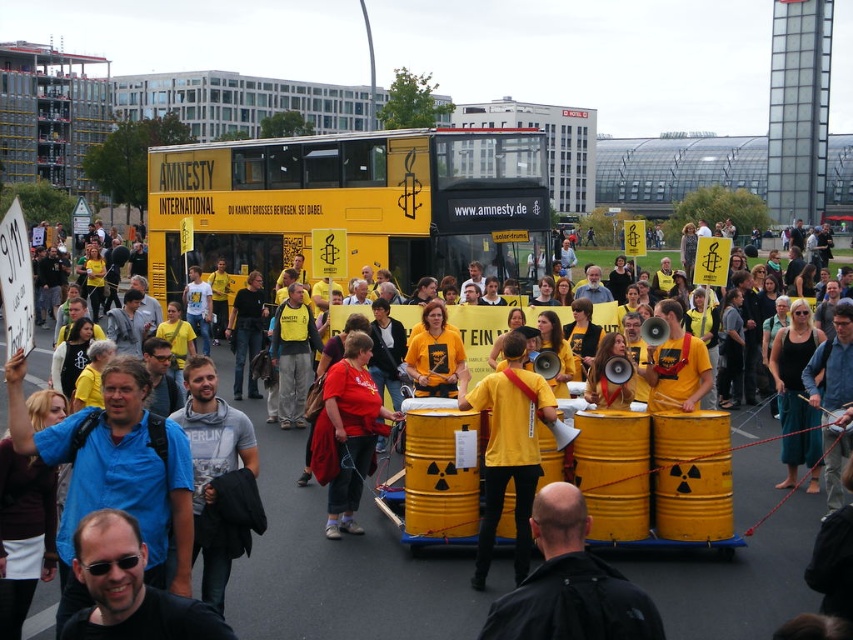
Question: Estimate the real-world distances between objects in this image. Which object is farther from the yellow fabric megaphone at center?

Choices:
 (A) blue cotton shirt at center
 (B) light gray cotton t-shirt at center

Answer: (A)

Question: Does yellow fabric megaphone at center lie in front of yellow/yellowish fabric shirt at center?

Choices:
 (A) no
 (B) yes

Answer: (B)

Question: Which point is closer to the camera?

Choices:
 (A) (305, 529)
 (B) (202, 410)
 (C) (679, 316)
 (D) (462, 385)

Answer: (B)

Question: Does yellow matte double-decker bus at center appear on the right side of yellow matte shirt at center?

Choices:
 (A) yes
 (B) no

Answer: (B)

Question: Is black fabric jacket at lower center wider than yellow fabric megaphone at center?

Choices:
 (A) no
 (B) yes

Answer: (B)

Question: Among these objects, which one is farthest from the camera?

Choices:
 (A) yellow matte drum at center
 (B) yellow/yellowish fabric shirt at center
 (C) light gray cotton t-shirt at center

Answer: (B)